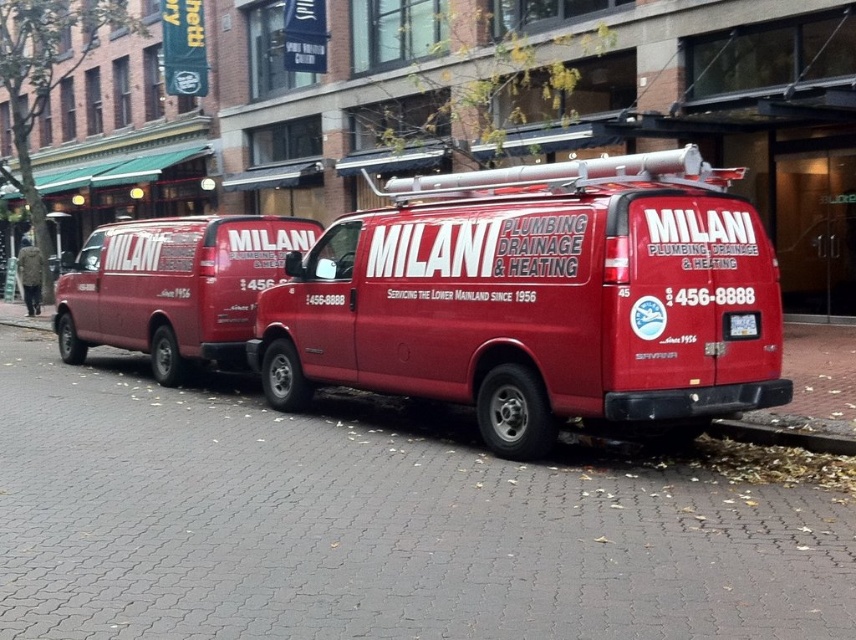
Locate an element on the screen. This screenshot has height=640, width=856. gray cobblestone pavement at center is located at coordinates (373, 524).

Does point (682, 522) lie in front of point (735, 364)?

Yes, point (682, 522) is in front of point (735, 364).

Find the location of a particular element. Image resolution: width=856 pixels, height=640 pixels. gray cobblestone pavement at center is located at coordinates (373, 524).

Is point (520, 266) in front of point (730, 438)?

That is True.

Who is positioned more to the left, matte red van at center or smooth concrete curb at lower right?

matte red van at center

In order to click on matte red van at center in this screenshot , I will do `click(539, 300)`.

Locate an element on the screen. Image resolution: width=856 pixels, height=640 pixels. matte red van at center is located at coordinates (539, 300).

Is gray cobblestone pavement at center above smooth concrete curb at lower right?

No, gray cobblestone pavement at center is not above smooth concrete curb at lower right.

At what (x,y) coordinates should I click in order to perform the action: click on gray cobblestone pavement at center. Please return your answer as a coordinate pair (x, y). The image size is (856, 640). Looking at the image, I should click on (373, 524).

The image size is (856, 640). In order to click on gray cobblestone pavement at center in this screenshot , I will do `click(373, 524)`.